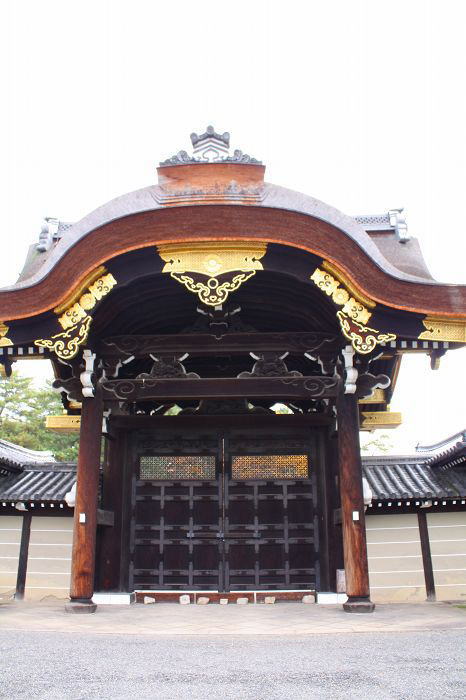
Identify the location of the right door. (274, 537).